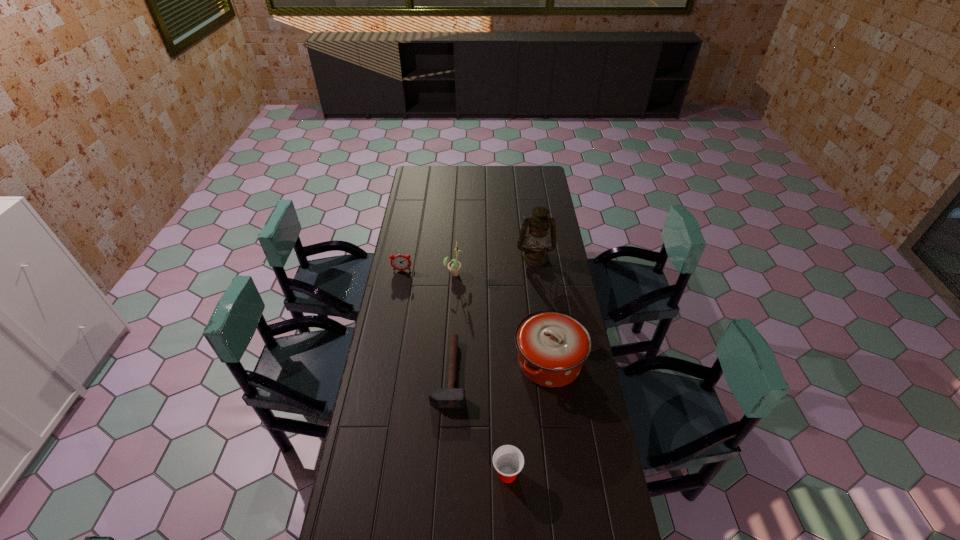
You are a GUI agent. You are given a task and a screenshot of the screen. Output one action in this format:
    pyautogui.click(x=<x>, y=<y>)
    Task: Click on the vacant space located on the front-facing side of the leftmost object
    The width and height of the screenshot is (960, 540).
    Given the screenshot: What is the action you would take?
    pyautogui.click(x=398, y=289)

Locate an element on the screen. free region located 0.110m on the left of the cup is located at coordinates (458, 474).

Find the location of a particular element. This screenshot has width=960, height=540. vacant point located on the striking surface of the shortest object is located at coordinates (552, 373).

Locate an element on the screen. The image size is (960, 540). object that is at the left edge is located at coordinates (399, 262).

You are a GUI agent. You are given a task and a screenshot of the screen. Output one action in this format:
    pyautogui.click(x=<x>, y=<y>)
    Task: Click on the oil lamp located in the right edge section of the desktop
    The height and width of the screenshot is (540, 960).
    Given the screenshot: What is the action you would take?
    pyautogui.click(x=535, y=254)

The height and width of the screenshot is (540, 960). Find the location of `casserole at the right edge`. casserole at the right edge is located at coordinates (552, 346).

The image size is (960, 540). I want to click on free region at the far edge of the desktop, so click(512, 173).

Identify the location of free space at the left edge. The height and width of the screenshot is (540, 960). (408, 328).

In the image, there is a desktop. Where is `blank space at the right edge`? This screenshot has height=540, width=960. blank space at the right edge is located at coordinates (x=535, y=206).

What are the coordinates of `vacant space at the far left corner` in the screenshot? It's located at (424, 183).